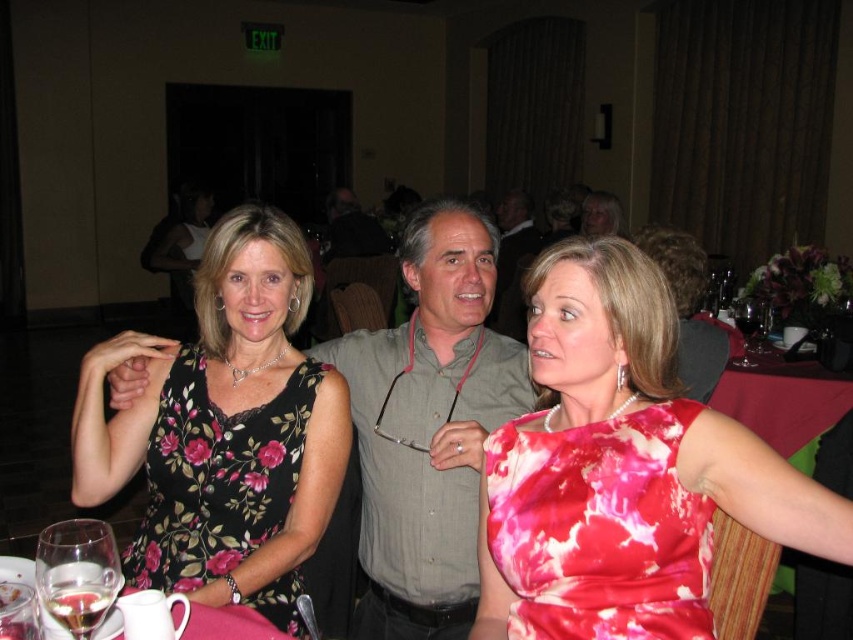
You are a photographer setting up for a group photo. You need to ensure that the gray striped shirt at center and the pink fabric table at lower left are both in focus. The camera you are using has a depth of field that can cover objects within a 60 cm range. Can both objects be in focus simultaneously?

The gray striped shirt at center is 57.80 centimeters away from the pink fabric table at lower left. Since the distance between them is less than 60 cm, both objects can be in focus simultaneously with the camera.

You are a server at the banquet hall and need to place a new wine glass on the table. The new wine glass is the same size as the clear glass wine glass at lower left. Will it fit on the pink fabric table at lower left without overlapping the edge?

The clear glass wine glass at lower left is narrower than the pink fabric table at lower left, so the new wine glass will fit on the table without overlapping the edge since its width is less than the table.

You are at the banquet hall and want to find the gray striped shirt at center. According to the coordinates provided, where would you look first?

You should look at point 0.666 on the x axis and 0.504 on the y axis to find the gray striped shirt at center.